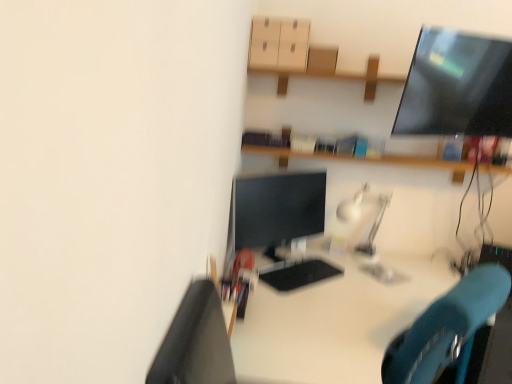
Question: Could you tell me if matte black monitor at center is facing white glossy desk at center?

Choices:
 (A) no
 (B) yes

Answer: (A)

Question: Considering the relative sizes of matte black monitor at center and white glossy desk at center in the image provided, is matte black monitor at center wider than white glossy desk at center?

Choices:
 (A) yes
 (B) no

Answer: (B)

Question: From the image's perspective, is matte black monitor at center on white glossy desk at center?

Choices:
 (A) no
 (B) yes

Answer: (B)

Question: Considering the relative positions of matte black monitor at center and white glossy desk at center in the image provided, is matte black monitor at center to the right of white glossy desk at center from the viewer's perspective?

Choices:
 (A) no
 (B) yes

Answer: (A)

Question: Is matte black monitor at center placed right next to white glossy desk at center?

Choices:
 (A) no
 (B) yes

Answer: (A)

Question: Considering the positions of matte black monitor at center and matte cardboard drawer at upper center in the image, is matte black monitor at center taller or shorter than matte cardboard drawer at upper center?

Choices:
 (A) short
 (B) tall

Answer: (B)

Question: Considering their positions, is matte black monitor at center located in front of or behind matte cardboard drawer at upper center?

Choices:
 (A) behind
 (B) front

Answer: (B)

Question: From a real-world perspective, relative to matte cardboard drawer at upper center, is matte black monitor at center vertically above or below?

Choices:
 (A) below
 (B) above

Answer: (A)

Question: Based on their positions, is matte black monitor at center located to the left or right of matte cardboard drawer at upper center?

Choices:
 (A) left
 (B) right

Answer: (A)

Question: In terms of width, does matte cardboard drawer at upper center look wider or thinner when compared to satin silver lamp at center?

Choices:
 (A) wide
 (B) thin

Answer: (A)

Question: From the image's perspective, is matte cardboard drawer at upper center located above or below satin silver lamp at center?

Choices:
 (A) below
 (B) above

Answer: (B)

Question: Based on their sizes in the image, would you say matte cardboard drawer at upper center is bigger or smaller than satin silver lamp at center?

Choices:
 (A) big
 (B) small

Answer: (B)

Question: Considering their positions, is matte cardboard drawer at upper center located in front of or behind satin silver lamp at center?

Choices:
 (A) behind
 (B) front

Answer: (B)

Question: From a real-world perspective, is satin silver lamp at center physically located above or below white glossy desk at center?

Choices:
 (A) below
 (B) above

Answer: (B)

Question: Is point (354, 198) positioned closer to the camera than point (452, 294)?

Choices:
 (A) farther
 (B) closer

Answer: (A)